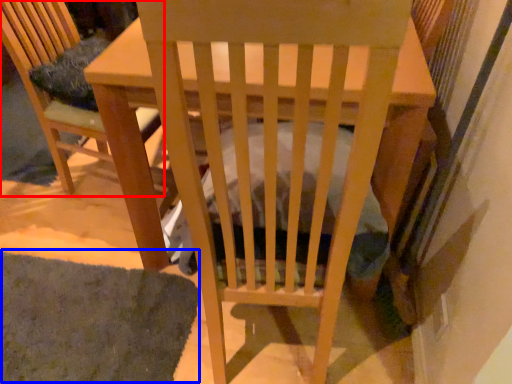
Question: Which object is closer to the camera taking this photo, chair (highlighted by a red box) or mat (highlighted by a blue box)?

Choices:
 (A) chair
 (B) mat

Answer: (B)